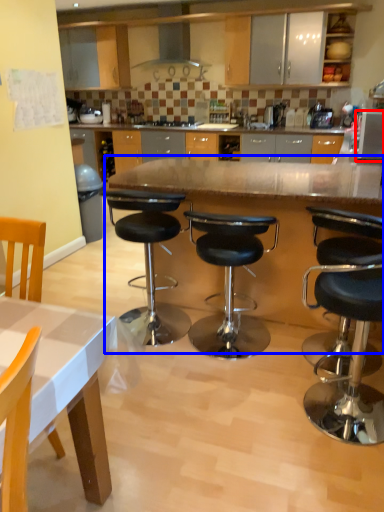
Question: Which of the following is the farthest to the observer, appliance (highlighted by a red box) or table (highlighted by a blue box)?

Choices:
 (A) appliance
 (B) table

Answer: (A)